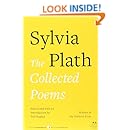
Image resolution: width=130 pixels, height=130 pixels. Find the location of `corner`. corner is located at coordinates (98, 20), (24, 18), (26, 127), (94, 128).